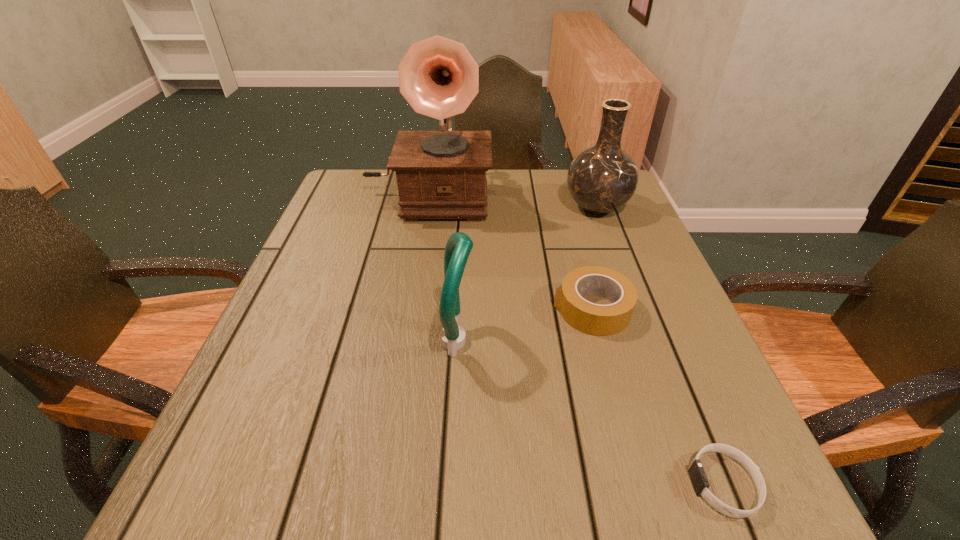
Where is `duct tape located in the right edge section of the desktop`? This screenshot has width=960, height=540. duct tape located in the right edge section of the desktop is located at coordinates (601, 320).

The height and width of the screenshot is (540, 960). I want to click on wristband present at the right edge, so click(697, 474).

Locate an element on the screen. This screenshot has height=540, width=960. object present at the far left corner is located at coordinates click(x=441, y=174).

This screenshot has width=960, height=540. Find the location of `object at the far right corner`. object at the far right corner is located at coordinates (601, 179).

Image resolution: width=960 pixels, height=540 pixels. Find the location of `object that is positioned at the near right corner`. object that is positioned at the near right corner is located at coordinates (697, 474).

Where is `free space at the far edge of the desktop`? free space at the far edge of the desktop is located at coordinates (399, 207).

In the image, there is a desktop. Where is `free space at the near edge`? This screenshot has height=540, width=960. free space at the near edge is located at coordinates (582, 495).

The width and height of the screenshot is (960, 540). In the image, there is a desktop. Find the location of `vacant space at the left edge`. vacant space at the left edge is located at coordinates (294, 341).

You are a GUI agent. You are given a task and a screenshot of the screen. Output one action in this format:
    pyautogui.click(x=<x>, y=<y>)
    Task: Click on the free region at the right edge of the desktop
    This screenshot has width=960, height=540.
    Given the screenshot: What is the action you would take?
    pyautogui.click(x=702, y=376)

This screenshot has width=960, height=540. I want to click on vacant space at the far left corner of the desktop, so click(372, 182).